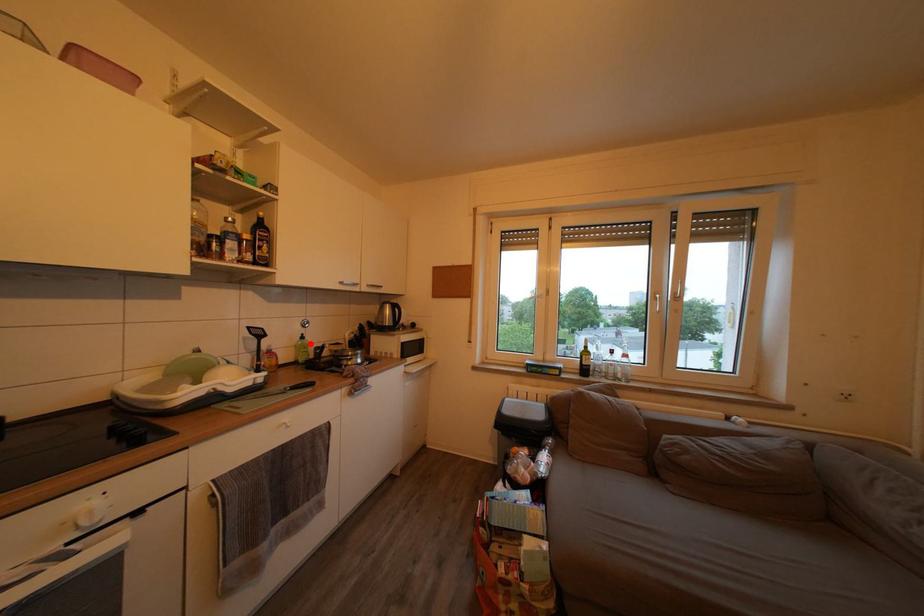
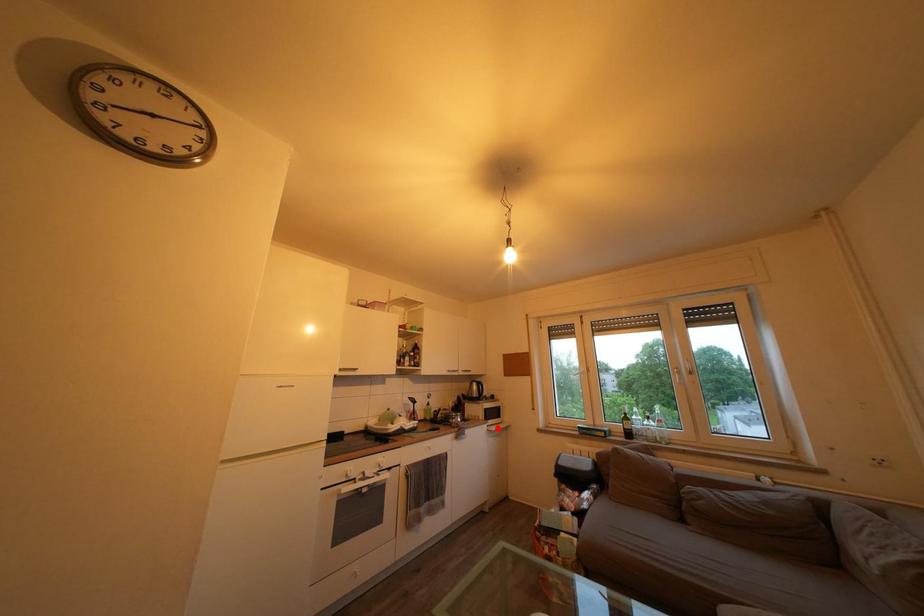
I am providing you with two images of the same scene from different viewpoints. A red point is marked on the first image and another point is marked on the second image. Is the red point in image1 aligned with the point shown in image2?

No